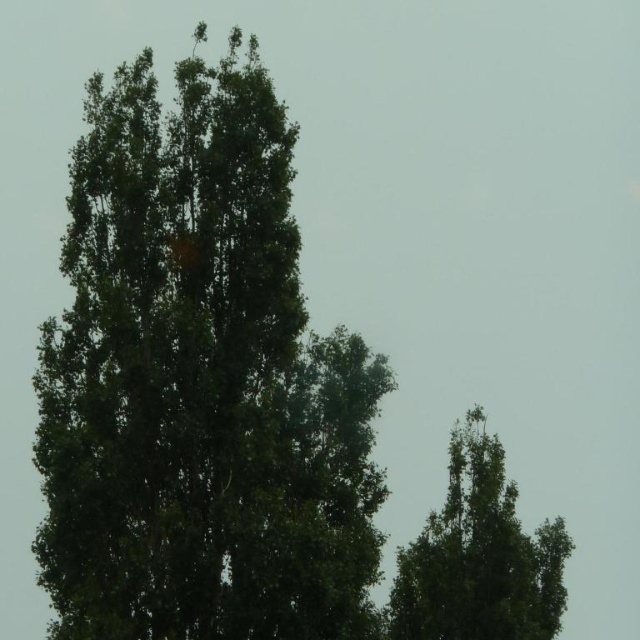
Is green leafy tree at center shorter than green leafy tree at upper right?

Incorrect, green leafy tree at center's height does not fall short of green leafy tree at upper right's.

Between point (70, 371) and point (442, 628), which one is positioned behind?

Point (442, 628)

Where is `green leafy tree at center`? green leafy tree at center is located at coordinates (198, 384).